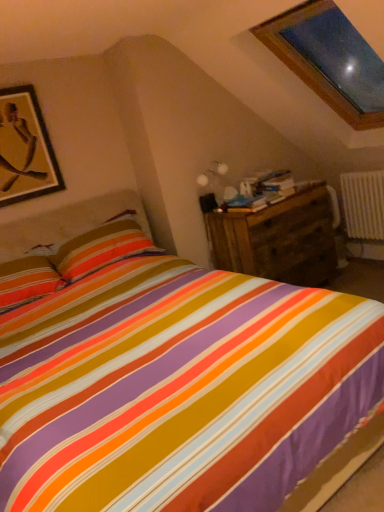
Where is `white plastic radiator at right`? Image resolution: width=384 pixels, height=512 pixels. white plastic radiator at right is located at coordinates (363, 205).

Which is behind, point (246, 268) or point (366, 194)?

Positioned behind is point (366, 194).

Is wooden chest of drawers at right touching white plastic radiator at right?

They are not placed beside each other.

Is wooden chest of drawers at right at the right side of white plastic radiator at right?

No, wooden chest of drawers at right is not to the right of white plastic radiator at right.

Between wooden chest of drawers at right and white plastic radiator at right, which one has smaller size?

With smaller size is white plastic radiator at right.

Can you confirm if white plastic radiator at right is positioned to the right of wooden chest of drawers at right?

Correct, you'll find white plastic radiator at right to the right of wooden chest of drawers at right.

Considering the relative sizes of white plastic radiator at right and wooden chest of drawers at right in the image provided, is white plastic radiator at right smaller than wooden chest of drawers at right?

Indeed, white plastic radiator at right has a smaller size compared to wooden chest of drawers at right.

Is white plastic radiator at right shorter than wooden chest of drawers at right?

Yes, white plastic radiator at right is shorter than wooden chest of drawers at right.

Is white plastic radiator at right facing away from wooden chest of drawers at right?

No, white plastic radiator at right's orientation is not away from wooden chest of drawers at right.

Considering the positions of objects gold matte picture frame at upper left and wooden chest of drawers at right in the image provided, who is in front, gold matte picture frame at upper left or wooden chest of drawers at right?

gold matte picture frame at upper left is closer to the camera.

Considering the sizes of objects gold matte picture frame at upper left and wooden chest of drawers at right in the image provided, who is wider, gold matte picture frame at upper left or wooden chest of drawers at right?

wooden chest of drawers at right.

In the scene shown: Could you tell me if gold matte picture frame at upper left is facing wooden chest of drawers at right?

No, gold matte picture frame at upper left is not facing towards wooden chest of drawers at right.

Considering the sizes of gold matte picture frame at upper left and wooden chest of drawers at right in the image, is gold matte picture frame at upper left bigger or smaller than wooden chest of drawers at right?

Clearly, gold matte picture frame at upper left is smaller in size than wooden chest of drawers at right.

Considering the relative positions of wooden chest of drawers at right and gold matte picture frame at upper left in the image provided, is wooden chest of drawers at right to the left of gold matte picture frame at upper left from the viewer's perspective?

In fact, wooden chest of drawers at right is to the right of gold matte picture frame at upper left.

Is wooden chest of drawers at right positioned with its back to gold matte picture frame at upper left?

No.

Based on the photo, is wooden chest of drawers at right closer to camera compared to gold matte picture frame at upper left?

No, the depth of wooden chest of drawers at right is greater than that of gold matte picture frame at upper left.

Is wooden chest of drawers at right not close to gold matte picture frame at upper left?

Yes, wooden chest of drawers at right and gold matte picture frame at upper left are quite far apart.

Is white plastic radiator at right oriented away from gold matte picture frame at upper left?

white plastic radiator at right does not have its back to gold matte picture frame at upper left.

From a real-world perspective, which object stands above the other?

gold matte picture frame at upper left.

Are white plastic radiator at right and gold matte picture frame at upper left far apart?

Yes, white plastic radiator at right and gold matte picture frame at upper left are quite far apart.

Is gold matte picture frame at upper left a part of white plastic radiator at right?

No, gold matte picture frame at upper left is not inside white plastic radiator at right.

Can you confirm if gold matte picture frame at upper left is positioned to the left of white plastic radiator at right?

Correct, you'll find gold matte picture frame at upper left to the left of white plastic radiator at right.

Who is shorter, gold matte picture frame at upper left or white plastic radiator at right?

With less height is white plastic radiator at right.

Which is in front, gold matte picture frame at upper left or white plastic radiator at right?

Positioned in front is gold matte picture frame at upper left.

Find the location of a particular element. nightstand in front of the white plastic radiator at right is located at coordinates (278, 239).

The image size is (384, 512). I want to click on radiator on the right of wooden chest of drawers at right, so click(x=363, y=205).

Based on their spatial positions, is gold matte picture frame at upper left or white plastic radiator at right closer to wooden chest of drawers at right?

white plastic radiator at right.

When comparing their distances from wooden chest of drawers at right, does white plastic radiator at right or gold matte picture frame at upper left seem closer?

white plastic radiator at right is positioned closer to the anchor wooden chest of drawers at right.

When comparing their distances from white plastic radiator at right, does gold matte picture frame at upper left or wooden chest of drawers at right seem further?

The object further to white plastic radiator at right is gold matte picture frame at upper left.

Estimate the real-world distances between objects in this image. Which object is further from white plastic radiator at right, wooden chest of drawers at right or gold matte picture frame at upper left?

gold matte picture frame at upper left.

Considering their positions, is wooden chest of drawers at right positioned closer to gold matte picture frame at upper left than white plastic radiator at right?

wooden chest of drawers at right is closer to gold matte picture frame at upper left.

Based on their spatial positions, is white plastic radiator at right or wooden chest of drawers at right closer to gold matte picture frame at upper left?

Among the two, wooden chest of drawers at right is located nearer to gold matte picture frame at upper left.

Identify the location of nightstand located between gold matte picture frame at upper left and white plastic radiator at right in the left-right direction. Image resolution: width=384 pixels, height=512 pixels. (278, 239).